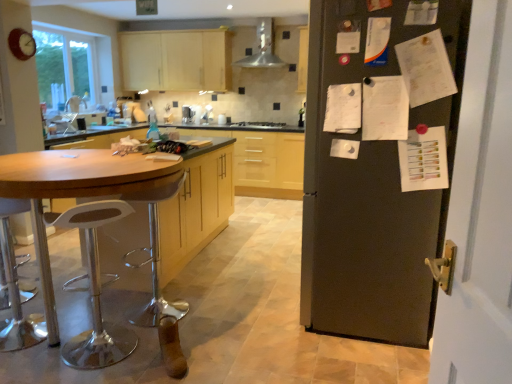
Locate an element on the screen. This screenshot has height=384, width=512. unoccupied region to the right of wooden table at left is located at coordinates (246, 310).